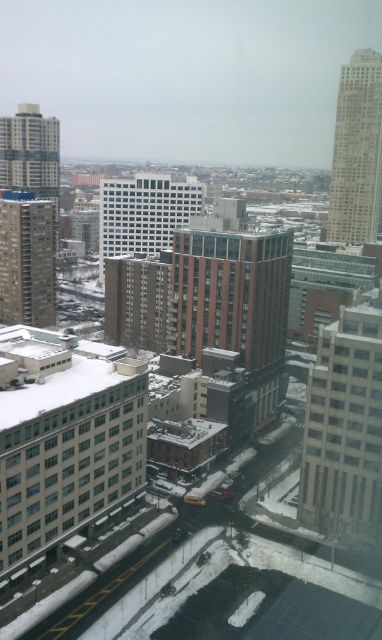
Question: Does white glass windows at lower left have a lesser width compared to white glass building at center?

Choices:
 (A) no
 (B) yes

Answer: (B)

Question: Does white glass windows at lower left appear on the right side of white glass building at center?

Choices:
 (A) no
 (B) yes

Answer: (B)

Question: Can you confirm if white glass windows at lower left is bigger than white glass building at center?

Choices:
 (A) no
 (B) yes

Answer: (A)